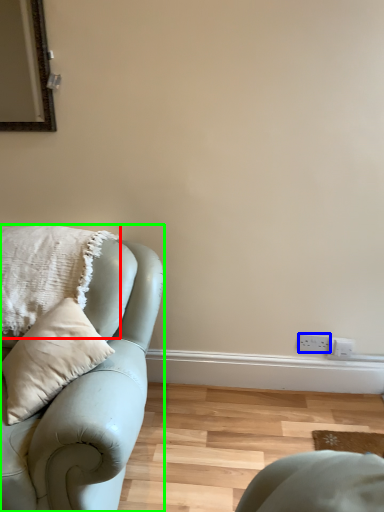
Question: Which object is positioned closest to pillow (highlighted by a red box)? Select from electric outlet (highlighted by a blue box) and studio couch (highlighted by a green box).

Choices:
 (A) electric outlet
 (B) studio couch

Answer: (B)